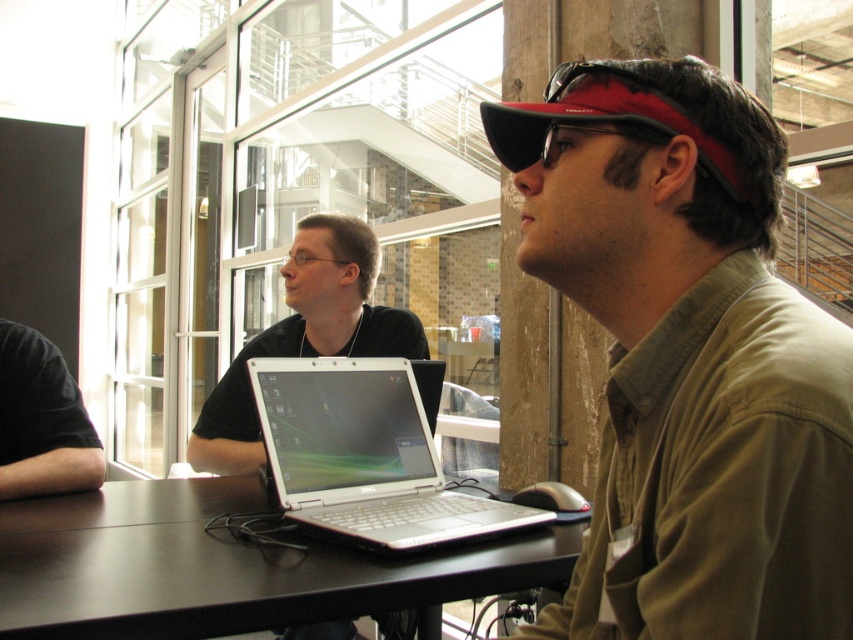
Is dark brown wooden table at center shorter than white glossy laptop at center?

Yes.

This screenshot has width=853, height=640. What do you see at coordinates (222, 566) in the screenshot?
I see `dark brown wooden table at center` at bounding box center [222, 566].

Find the location of `dark brown wooden table at center`. dark brown wooden table at center is located at coordinates (222, 566).

In order to click on dark brown wooden table at center in this screenshot , I will do `click(222, 566)`.

Is the position of matte khaki shirt at center less distant than that of black matte baseball cap at upper right?

Yes.

Is point (628, 506) positioned before point (705, 138)?

No, (628, 506) is behind (705, 138).

Between point (636, 220) and point (527, 106), which one is positioned in front?

Positioned in front is point (636, 220).

The height and width of the screenshot is (640, 853). I want to click on matte khaki shirt at center, so click(688, 358).

Who is positioned more to the left, silver metallic laptop at center or white glossy laptop at center?

white glossy laptop at center is more to the left.

Which is above, silver metallic laptop at center or white glossy laptop at center?

white glossy laptop at center

Where is `silver metallic laptop at center`? silver metallic laptop at center is located at coordinates (364, 456).

At what (x,y) coordinates should I click in order to perform the action: click on silver metallic laptop at center. Please return your answer as a coordinate pair (x, y). The height and width of the screenshot is (640, 853). Looking at the image, I should click on (364, 456).